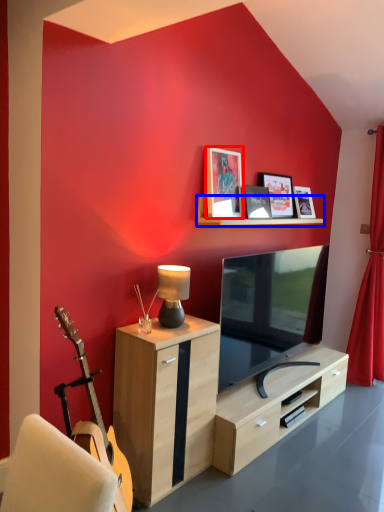
Question: Which of the following is the closest to the observer, picture frame (highlighted by a red box) or shelf (highlighted by a blue box)?

Choices:
 (A) picture frame
 (B) shelf

Answer: (B)